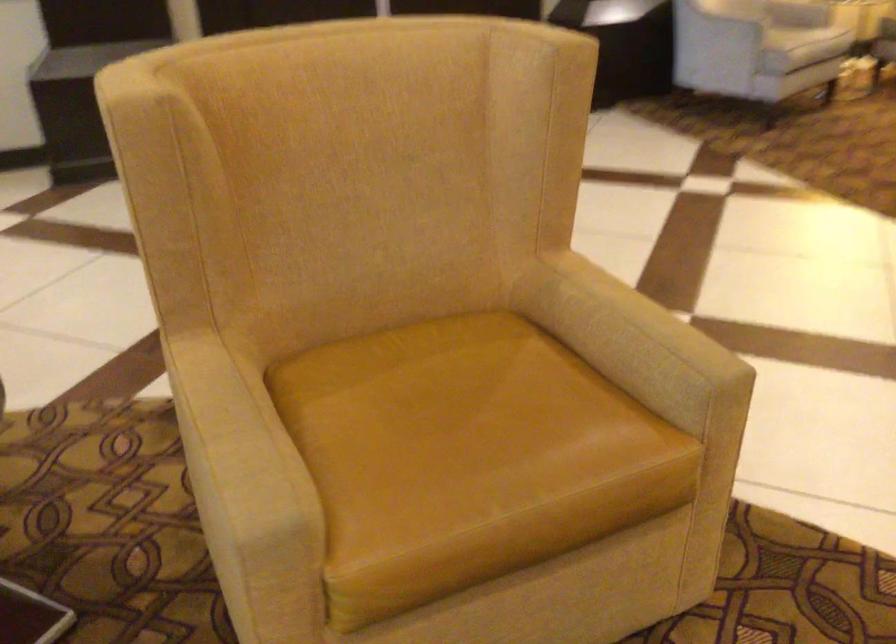
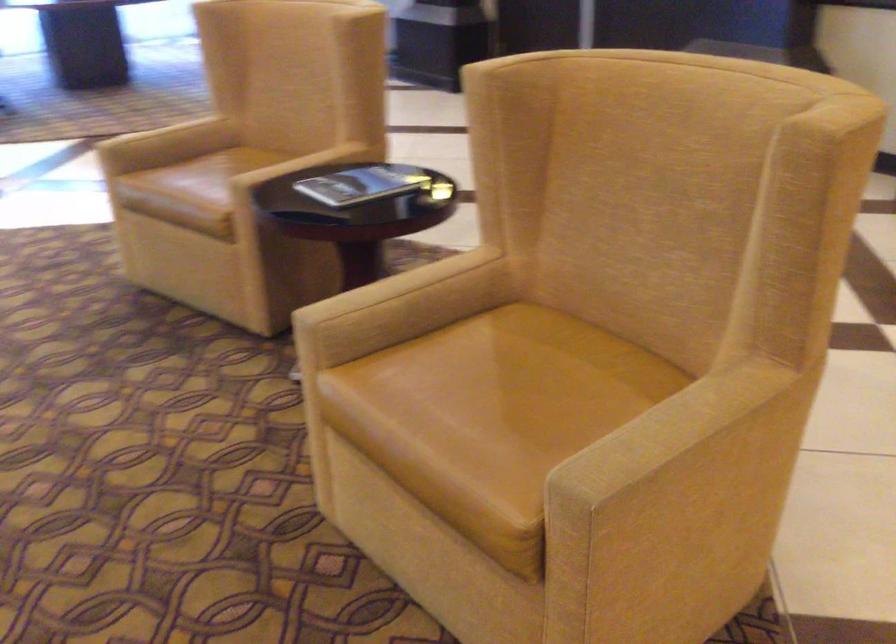
The point at (x=643, y=314) is marked in the first image. Where is the corresponding point in the second image?

(707, 433)